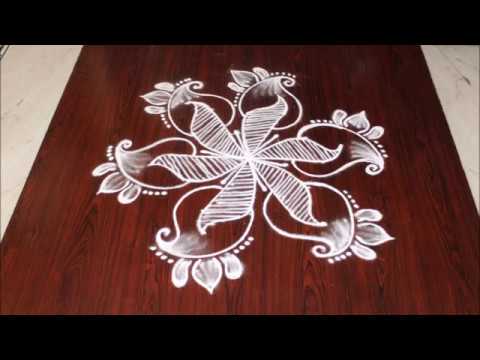
Where is `vrowwn table`? The width and height of the screenshot is (480, 360). vrowwn table is located at coordinates (77, 280).